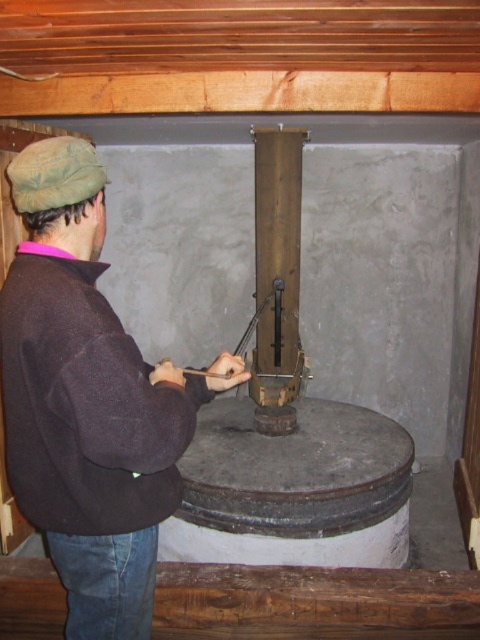
Which is below, brown fleece jacket at left or rusty metal pole at center?

brown fleece jacket at left is lower down.

Can you confirm if brown fleece jacket at left is smaller than rusty metal pole at center?

Actually, brown fleece jacket at left might be larger than rusty metal pole at center.

Is point (48, 172) in front of point (274, 396)?

Yes, point (48, 172) is closer to viewer.

The height and width of the screenshot is (640, 480). Identify the location of brown fleece jacket at left. (87, 401).